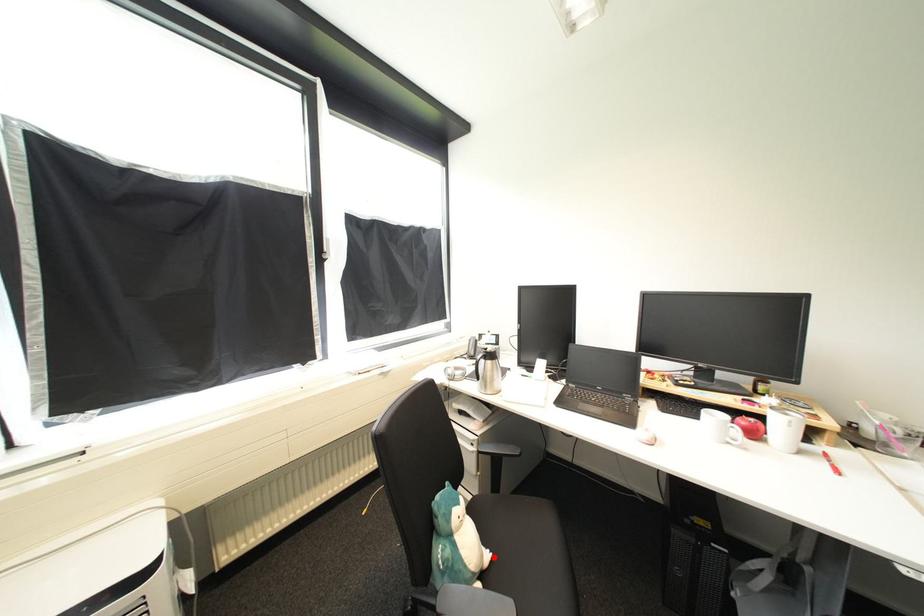
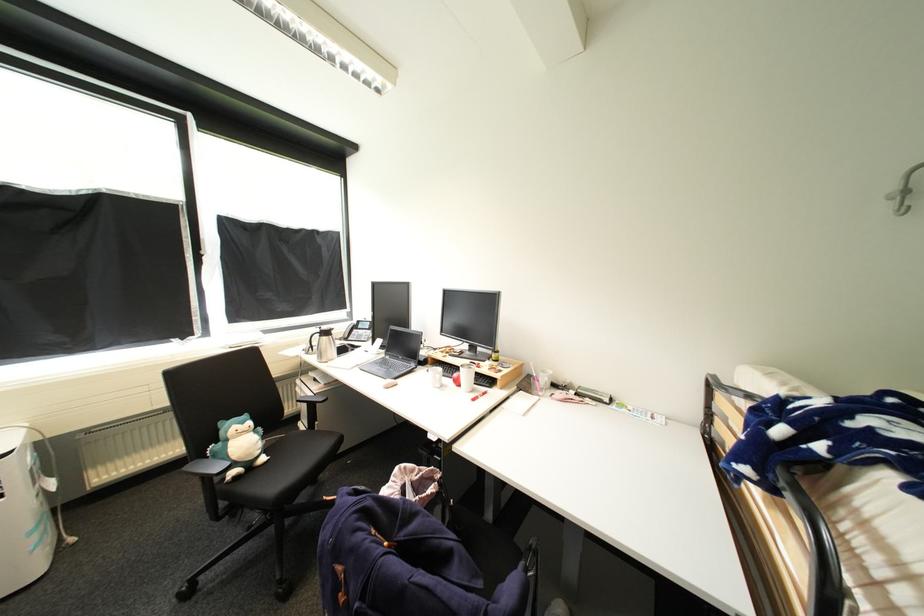
Question: I am providing you with two images of the same scene from different viewpoints. A red point is marked on the first image. At the location where the point appears in image 1, is it still visible in image 2?

Choices:
 (A) Yes
 (B) No

Answer: (A)